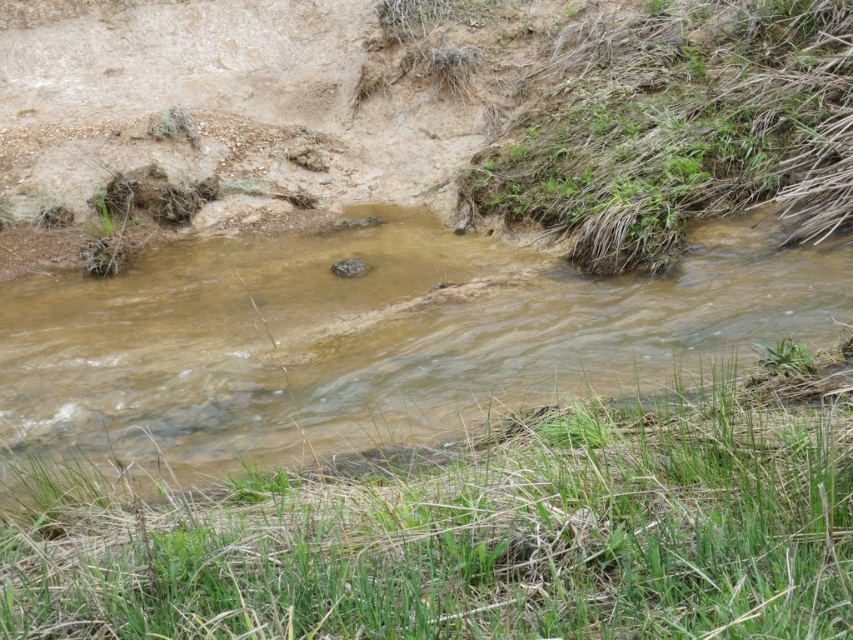
You are a hiker carrying a heavy backpack and need to cross the stream. You see the green grass at lower center and the brown muddy water at center. How far apart are these two landmarks?

The green grass at lower center and brown muddy water at center are 5.54 meters apart from each other.